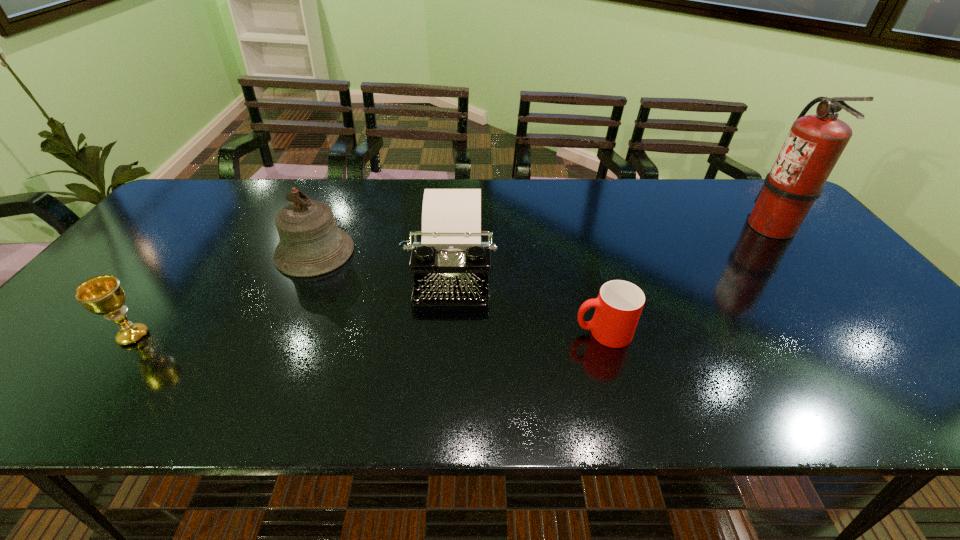
The height and width of the screenshot is (540, 960). I want to click on the rightmost object, so click(x=814, y=144).

Locate an element on the screen. The height and width of the screenshot is (540, 960). the tallest object is located at coordinates (814, 144).

Where is `bell`? This screenshot has height=540, width=960. bell is located at coordinates (310, 243).

Identify the location of the fourth shortest object. (310, 243).

The height and width of the screenshot is (540, 960). What are the coordinates of `the third object from right to left` in the screenshot? It's located at pyautogui.click(x=450, y=265).

What are the coordinates of `chalice` in the screenshot? It's located at (103, 295).

Image resolution: width=960 pixels, height=540 pixels. Identify the location of the fourth object from left to right. (618, 307).

Locate an element on the screen. the shortest object is located at coordinates (618, 307).

Locate an element on the screen. vacant area situated toward the nozzle of the tallest object is located at coordinates (687, 226).

Locate an element on the screen. This screenshot has height=540, width=960. free space located toward the nozzle of the tallest object is located at coordinates (660, 226).